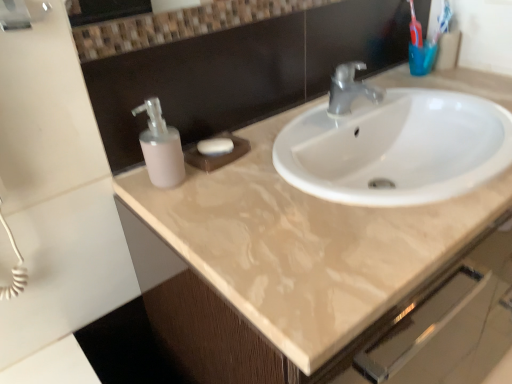
Question: From the image's perspective, is matte plastic soap dispenser at left located above or below beige glossy sink at upper center?

Choices:
 (A) below
 (B) above

Answer: (B)

Question: Is point (165, 172) positioned closer to the camera than point (144, 281)?

Choices:
 (A) farther
 (B) closer

Answer: (B)

Question: Estimate the real-world distances between objects in this image. Which object is closer to the matte plastic soap dispenser at left?

Choices:
 (A) blue plastic toothbrush at upper right
 (B) white matte soap at center
 (C) beige glossy sink at upper center

Answer: (B)

Question: Considering the real-world distances, which object is farthest from the beige glossy sink at upper center?

Choices:
 (A) matte plastic soap dispenser at left
 (B) blue plastic toothbrush at upper right
 (C) white matte soap at center

Answer: (B)